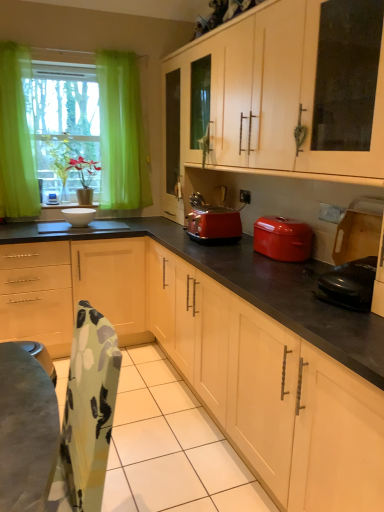
Locate an element on the screen. The height and width of the screenshot is (512, 384). matte wood cabinets at center, acting as the second cabinetry starting from the top is located at coordinates (226, 346).

How much space does black glossy electric kettle at lower right, marked as the 1th appliance in a right-to-left arrangement, occupy vertically?

black glossy electric kettle at lower right, marked as the 1th appliance in a right-to-left arrangement, is 7.88 inches in height.

Measure the distance between black glossy electric kettle at lower right, which is the 1th appliance in front-to-back order, and camera.

The depth of black glossy electric kettle at lower right, which is the 1th appliance in front-to-back order, is 4.79 feet.

Where is `white glossy bowl at center, which is counted as the 1th appliance, starting from the back`? The height and width of the screenshot is (512, 384). white glossy bowl at center, which is counted as the 1th appliance, starting from the back is located at coordinates (79, 216).

What do you see at coordinates (79, 216) in the screenshot? I see `white glossy bowl at center, positioned as the 2th appliance in front-to-back order` at bounding box center [79, 216].

Find the location of a particular element. This screenshot has width=384, height=512. shiny red toaster at center is located at coordinates (213, 224).

From the image's perspective, between black glossy electric kettle at lower right, which is the 1th appliance in front-to-back order, and white glossy bowl at center, which is counted as the 1th appliance, starting from the back, who is located below?

black glossy electric kettle at lower right, which is the 1th appliance in front-to-back order, appears lower in the image.

Measure the distance from black glossy electric kettle at lower right, marked as the 1th appliance in a right-to-left arrangement, to white glossy bowl at center, which is counted as the 1th appliance, starting from the back.

1.92 meters.

Does black glossy electric kettle at lower right, marked as the 1th appliance in a right-to-left arrangement, turn towards white glossy bowl at center, the first appliance when ordered from top to bottom?

No, black glossy electric kettle at lower right, marked as the 1th appliance in a right-to-left arrangement, is not aimed at white glossy bowl at center, the first appliance when ordered from top to bottom.

Considering the relative positions of black glossy electric kettle at lower right, which appears as the 2th appliance when viewed from the top, and white glossy bowl at center, the second appliance from the bottom, in the image provided, is black glossy electric kettle at lower right, which appears as the 2th appliance when viewed from the top, to the left or to the right of white glossy bowl at center, the second appliance from the bottom,?

From the image, it's evident that black glossy electric kettle at lower right, which appears as the 2th appliance when viewed from the top, is to the right of white glossy bowl at center, the second appliance from the bottom.

From the image's perspective, is green sheer curtain at left under white glossy bowl at center, arranged as the first appliance when viewed from the left?

No, from the image's perspective, green sheer curtain at left is not beneath white glossy bowl at center, arranged as the first appliance when viewed from the left.

From the image's perspective, count 1st appliances downward from the green sheer curtain at left and point to it. Please provide its 2D coordinates.

[(79, 216)]

Would you say green sheer curtain at left is outside white glossy bowl at center, the second appliance from the bottom?

Indeed, green sheer curtain at left is completely outside white glossy bowl at center, the second appliance from the bottom.

Who is bigger, green sheer curtain at left or white glossy bowl at center, positioned as the 2th appliance in front-to-back order?

green sheer curtain at left is bigger.

Can you tell me how much white glossy bowl at center, the first appliance when ordered from top to bottom, and matte red pot at right differ in facing direction?

There is a 90-degree angle between the facing directions of white glossy bowl at center, the first appliance when ordered from top to bottom, and matte red pot at right.

Between white glossy bowl at center, positioned as the second appliance in right-to-left order, and matte red pot at right, which one has smaller size?

white glossy bowl at center, positioned as the second appliance in right-to-left order, is smaller.

In the scene shown: Is white glossy bowl at center, positioned as the second appliance in right-to-left order, outside of matte red pot at right?

Yes, white glossy bowl at center, positioned as the second appliance in right-to-left order, is not within matte red pot at right.

Looking at this image, is matte red pot at right at the back of white glossy bowl at center, arranged as the first appliance when viewed from the left?

white glossy bowl at center, arranged as the first appliance when viewed from the left, does not have its back to matte red pot at right.

From the picture: Which of these two, white glossy bowl at center, the first appliance when ordered from top to bottom, or green sheer curtain at left, stands taller?

Standing taller between the two is green sheer curtain at left.

Consider the image. From the image's perspective, is white glossy bowl at center, which is counted as the 1th appliance, starting from the back, positioned above or below green sheer curtain at left?

Clearly, from the image's perspective, white glossy bowl at center, which is counted as the 1th appliance, starting from the back, is below green sheer curtain at left.

Based on their positions, is white glossy bowl at center, the second appliance from the bottom, located to the left or right of green sheer curtain at left?

Clearly, white glossy bowl at center, the second appliance from the bottom, is on the right of green sheer curtain at left in the image.

Where is `cabinetry below the white glossy bowl at left (from a real-world perspective)`? cabinetry below the white glossy bowl at left (from a real-world perspective) is located at coordinates (226, 346).

Considering the points (291, 278) and (57, 207), which point is behind, point (291, 278) or point (57, 207)?

The point (57, 207) is farther.

Considering the relative positions of matte wood cabinets at center, the 1th cabinetry when ordered from bottom to top, and white glossy bowl at left in the image provided, is matte wood cabinets at center, the 1th cabinetry when ordered from bottom to top, to the right of white glossy bowl at left from the viewer's perspective?

Yes, matte wood cabinets at center, the 1th cabinetry when ordered from bottom to top, is to the right of white glossy bowl at left.

From the picture: Looking at their sizes, would you say matte wood cabinets at center, acting as the second cabinetry starting from the top, is wider or thinner than white glossy bowl at left?

In the image, matte wood cabinets at center, acting as the second cabinetry starting from the top, appears to be wider than white glossy bowl at left.

Measure the distance from matte red pot at right to white glossy bowl at left.

1.69 meters.

Does matte red pot at right have a greater width compared to white glossy bowl at left?

Yes.

Where is `window sill above the matte red pot at right (from the image's perspective)`? window sill above the matte red pot at right (from the image's perspective) is located at coordinates (68, 205).

Is matte red pot at right to the right of white glossy bowl at left from the viewer's perspective?

Yes, matte red pot at right is to the right of white glossy bowl at left.

Which point is more distant from viewer, (249, 110) or (32, 150)?

Point (32, 150)

Do you think white matte cabinet at upper center, which appears as the 1th cabinetry when viewed from the top, is within green sheer curtain at left, or outside of it?

white matte cabinet at upper center, which appears as the 1th cabinetry when viewed from the top, is not enclosed by green sheer curtain at left.

Is white matte cabinet at upper center, the second cabinetry ordered from the bottom, positioned before green sheer curtain at left?

Yes, it is in front of green sheer curtain at left.

Between white matte cabinet at upper center, the second cabinetry ordered from the bottom, and green sheer curtain at left, which one has less height?

Standing shorter between the two is white matte cabinet at upper center, the second cabinetry ordered from the bottom.

The image size is (384, 512). Identify the location of appliance on the left side of black glossy electric kettle at lower right, which is the 1th appliance in front-to-back order. (79, 216).

Image resolution: width=384 pixels, height=512 pixels. In order to click on curtain that is in front of the white glossy bowl at center, the second appliance from the bottom in this screenshot , I will do `click(16, 137)`.

Which object lies further to the anchor point green sheer curtain at left, white glossy bowl at center, the second appliance from the bottom, or black glossy electric kettle at lower right, marked as the 2th appliance in a left-to-right arrangement?

The object further to green sheer curtain at left is black glossy electric kettle at lower right, marked as the 2th appliance in a left-to-right arrangement.

Which object lies nearer to the anchor point white glossy bowl at center, positioned as the second appliance in right-to-left order, shiny red toaster at center or green sheer curtain at left?

green sheer curtain at left is closer to white glossy bowl at center, positioned as the second appliance in right-to-left order.

When comparing their distances from shiny red toaster at center, does green sheer curtain at left or black glossy electric kettle at lower right, which appears as the 2th appliance when viewed from the top, seem further?

green sheer curtain at left.

When comparing their distances from green sheer curtain at left, does white matte cabinet at upper center, which appears as the 1th cabinetry when viewed from the top, or matte wood cabinets at center, the 1th cabinetry when ordered from bottom to top, seem closer?

white matte cabinet at upper center, which appears as the 1th cabinetry when viewed from the top, is closer to green sheer curtain at left.

From the image, which object appears to be farther from matte red pot at right, matte wood cabinets at center, acting as the second cabinetry starting from the top, or shiny red toaster at center?

Among the two, matte wood cabinets at center, acting as the second cabinetry starting from the top, is located further to matte red pot at right.

Looking at the image, which one is located closer to white glossy bowl at left, black glossy electric kettle at lower right, which appears as the 2th appliance when viewed from the top, or white matte cabinet at upper center, the second cabinetry ordered from the bottom?

white matte cabinet at upper center, the second cabinetry ordered from the bottom, is positioned closer to the anchor white glossy bowl at left.

When comparing their distances from matte wood cabinets at center, the 1th cabinetry when ordered from bottom to top, does white matte cabinet at upper center, which appears as the 1th cabinetry when viewed from the top, or white glossy bowl at left seem closer?

white matte cabinet at upper center, which appears as the 1th cabinetry when viewed from the top.

When comparing their distances from matte wood cabinets at center, acting as the second cabinetry starting from the top, does black glossy electric kettle at lower right, marked as the 2th appliance in a left-to-right arrangement, or white matte cabinet at upper center, which appears as the 1th cabinetry when viewed from the top, seem closer?

The object closer to matte wood cabinets at center, acting as the second cabinetry starting from the top, is black glossy electric kettle at lower right, marked as the 2th appliance in a left-to-right arrangement.

I want to click on kitchen appliance between matte wood cabinets at center, the 1th cabinetry when ordered from bottom to top, and shiny red toaster at center, along the z-axis, so click(282, 238).

Identify the location of kitchen appliance positioned between white matte cabinet at upper center, which appears as the 1th cabinetry when viewed from the top, and white glossy bowl at left from near to far. (282, 238).

Locate an element on the screen. appliance between white matte cabinet at upper center, the second cabinetry ordered from the bottom, and shiny red toaster at center from front to back is located at coordinates (349, 284).

In order to click on curtain between matte wood cabinets at center, the 1th cabinetry when ordered from bottom to top, and white glossy bowl at center, the second appliance from the bottom, from front to back in this screenshot , I will do `click(16, 137)`.